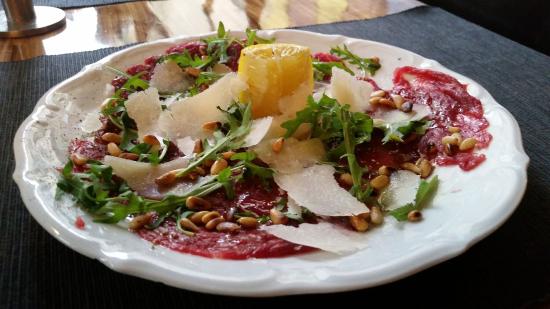
Image resolution: width=550 pixels, height=309 pixels. I want to click on white plate, so click(x=59, y=111).